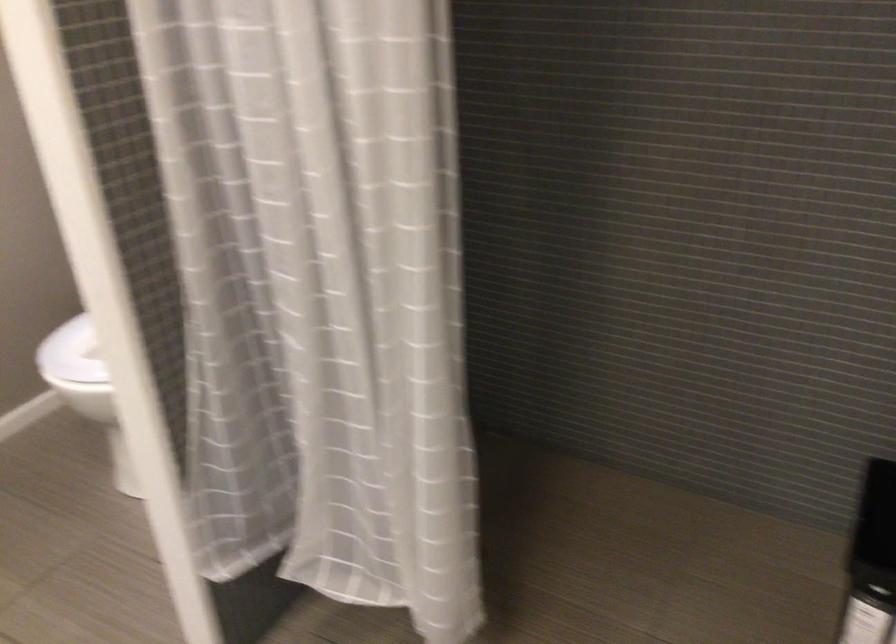
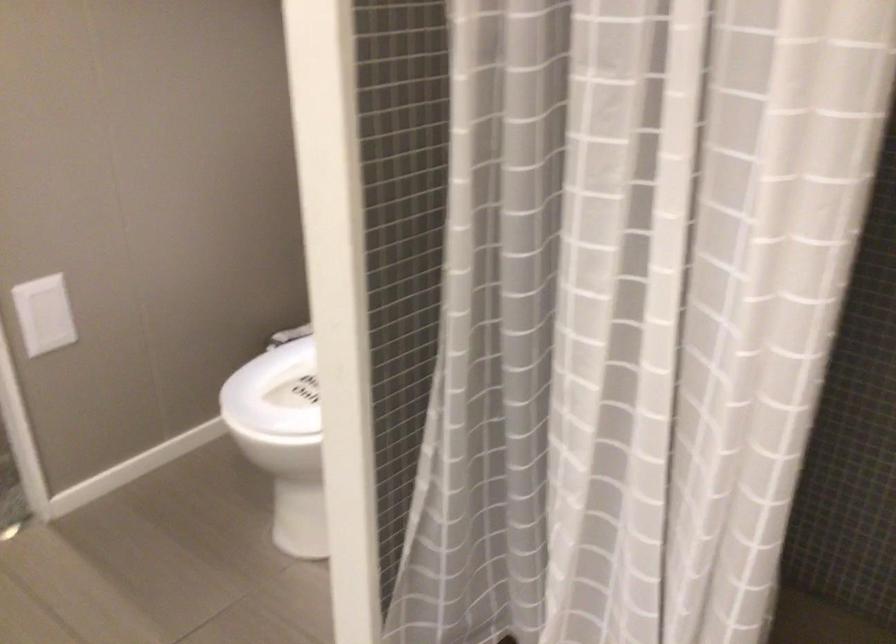
Question: The camera is either moving clockwise (left) or counter-clockwise (right) around the object. The first image is from the beginning of the video and the second image is from the end. Is the camera moving left or right when shooting the video?

Choices:
 (A) Left
 (B) Right

Answer: (B)